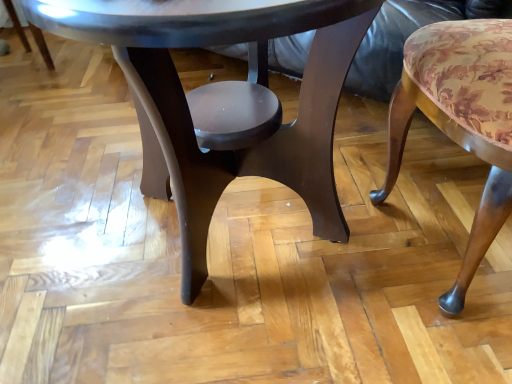
The height and width of the screenshot is (384, 512). What are the coordinates of `free space underneath floral fabric cushion at right (from a real-world perspective)` in the screenshot? It's located at (449, 230).